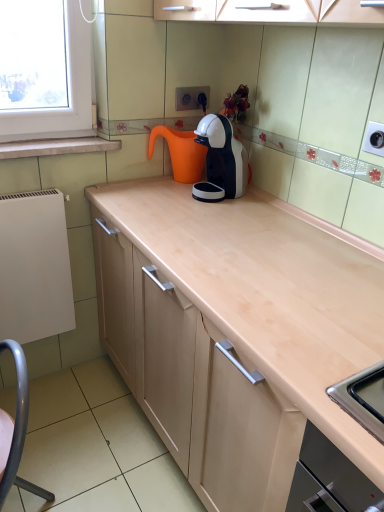
Question: Can you confirm if white marble window sill at upper left is positioned to the left of white matte radiator at left?

Choices:
 (A) yes
 (B) no

Answer: (B)

Question: Considering the relative sizes of white marble window sill at upper left and white matte radiator at left in the image provided, is white marble window sill at upper left bigger than white matte radiator at left?

Choices:
 (A) no
 (B) yes

Answer: (A)

Question: Considering the relative sizes of white marble window sill at upper left and white matte radiator at left in the image provided, is white marble window sill at upper left thinner than white matte radiator at left?

Choices:
 (A) no
 (B) yes

Answer: (A)

Question: Can you confirm if white marble window sill at upper left is taller than white matte radiator at left?

Choices:
 (A) no
 (B) yes

Answer: (A)

Question: Considering the relative sizes of white marble window sill at upper left and white matte radiator at left in the image provided, is white marble window sill at upper left wider than white matte radiator at left?

Choices:
 (A) yes
 (B) no

Answer: (A)

Question: From the image's perspective, is white glossy coffee machine at upper center above or below orange matte water jug at center?

Choices:
 (A) above
 (B) below

Answer: (B)

Question: Based on their sizes in the image, would you say white glossy coffee machine at upper center is bigger or smaller than orange matte water jug at center?

Choices:
 (A) small
 (B) big

Answer: (A)

Question: Relative to orange matte water jug at center, is white glossy coffee machine at upper center in front or behind?

Choices:
 (A) front
 (B) behind

Answer: (A)

Question: Is white glossy coffee machine at upper center spatially inside orange matte water jug at center, or outside of it?

Choices:
 (A) outside
 (B) inside

Answer: (A)

Question: From the image's perspective, is orange matte water jug at center positioned above or below white marble window sill at upper left?

Choices:
 (A) above
 (B) below

Answer: (A)

Question: Do you think orange matte water jug at center is within white marble window sill at upper left, or outside of it?

Choices:
 (A) inside
 (B) outside

Answer: (B)

Question: Considering the positions of orange matte water jug at center and white marble window sill at upper left in the image, is orange matte water jug at center taller or shorter than white marble window sill at upper left?

Choices:
 (A) short
 (B) tall

Answer: (B)

Question: Based on their sizes in the image, would you say orange matte water jug at center is bigger or smaller than white marble window sill at upper left?

Choices:
 (A) big
 (B) small

Answer: (A)

Question: Is point (173, 170) closer or farther from the camera than point (230, 152)?

Choices:
 (A) farther
 (B) closer

Answer: (A)

Question: Considering the positions of orange matte water jug at center and white glossy coffee machine at upper center in the image, is orange matte water jug at center wider or thinner than white glossy coffee machine at upper center?

Choices:
 (A) thin
 (B) wide

Answer: (B)